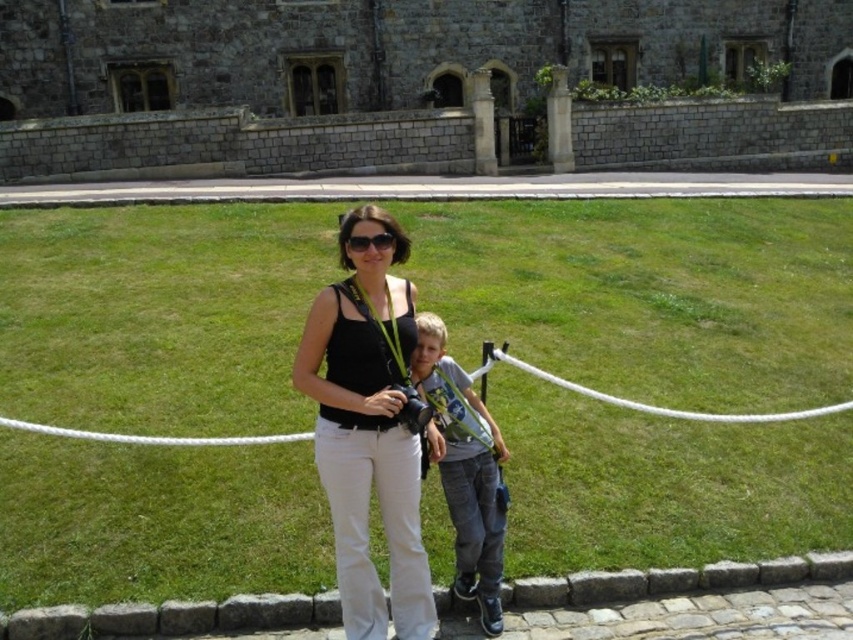
Is point (389, 570) behind point (383, 236)?

No.

Find the location of a particular element. black matte tank top at center is located at coordinates (368, 429).

This screenshot has width=853, height=640. Find the location of `black matte tank top at center`. black matte tank top at center is located at coordinates (368, 429).

In order to click on green grass at center in this screenshot , I will do `click(650, 292)`.

Does green grass at center appear over black plastic sunglasses at center?

No.

The width and height of the screenshot is (853, 640). What do you see at coordinates (650, 292) in the screenshot?
I see `green grass at center` at bounding box center [650, 292].

You are a GUI agent. You are given a task and a screenshot of the screen. Output one action in this format:
    pyautogui.click(x=<x>, y=<y>)
    Task: Click on the green grass at center
    
    Given the screenshot: What is the action you would take?
    pyautogui.click(x=650, y=292)

Between green grass at center and blue denim jeans at center, which one appears on the left side from the viewer's perspective?

blue denim jeans at center

Is point (642, 394) more distant than point (457, 524)?

Yes, point (642, 394) is farther from viewer.

In order to click on green grass at center in this screenshot , I will do `click(650, 292)`.